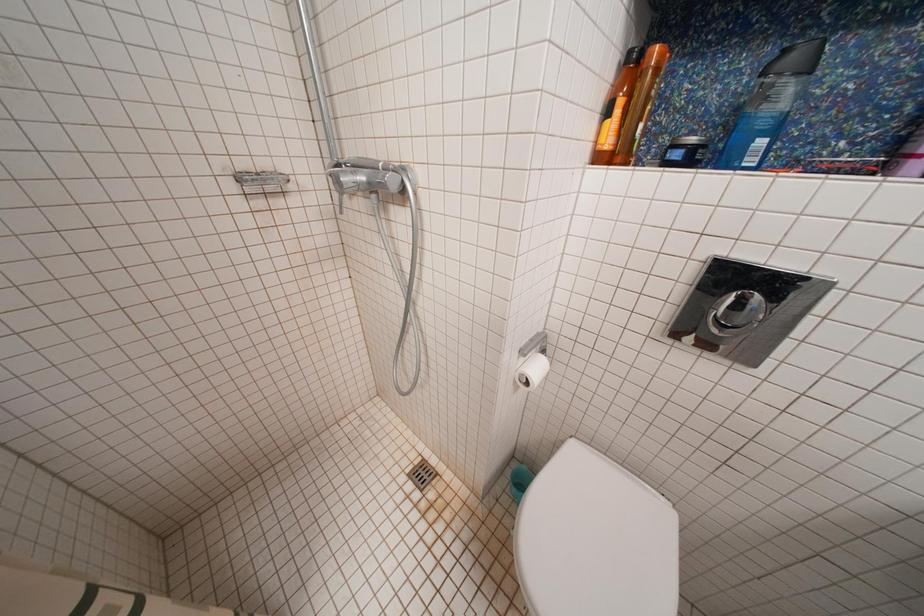
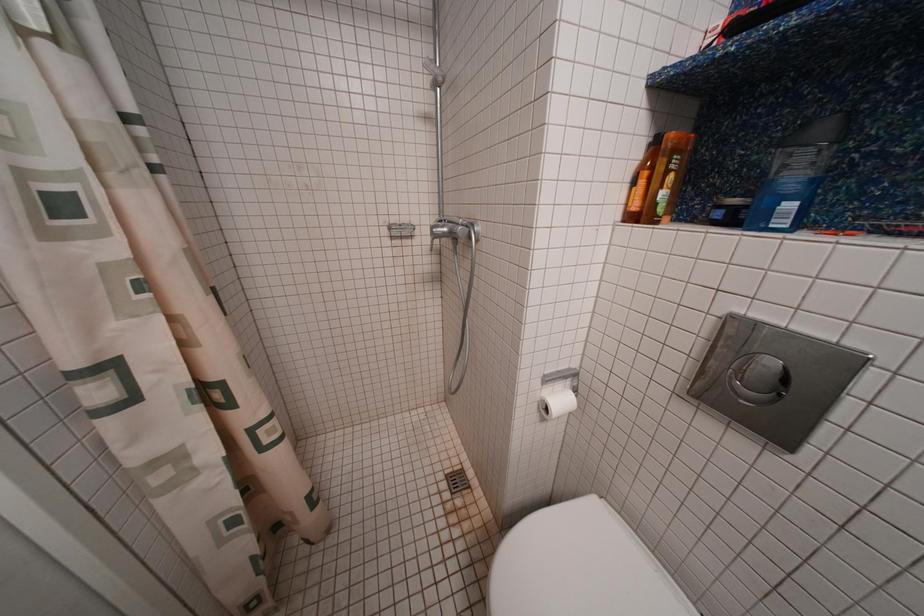
Question: The camera is either moving clockwise (left) or counter-clockwise (right) around the object. The first image is from the beginning of the video and the second image is from the end. Is the camera moving left or right when shooting the video?

Choices:
 (A) Left
 (B) Right

Answer: (B)